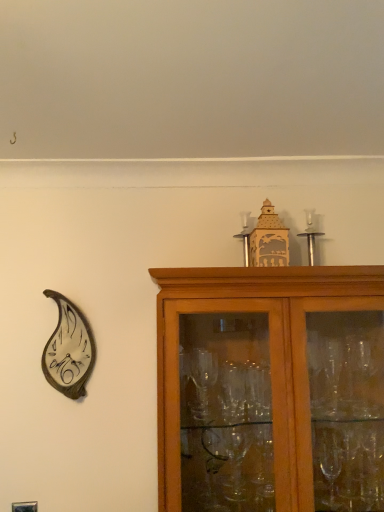
What do you see at coordinates (311, 234) in the screenshot? The width and height of the screenshot is (384, 512). I see `silver metallic candle holder at upper center, the first candle holder in the right-to-left sequence` at bounding box center [311, 234].

Where is `metallic leaf-shaped clock at left`? The width and height of the screenshot is (384, 512). metallic leaf-shaped clock at left is located at coordinates (69, 350).

Find the location of a particular element. This screenshot has width=384, height=512. silver metallic candle holder at upper center, which is the second candle holder from left to right is located at coordinates (311, 234).

Can we say brown wooden cabinet at upper right lies outside silver metallic candle holder at upper center, the 2th candle holder when ordered from right to left?

That's correct, brown wooden cabinet at upper right is outside of silver metallic candle holder at upper center, the 2th candle holder when ordered from right to left.

Between brown wooden cabinet at upper right and silver metallic candle holder at upper center, acting as the 1th candle holder starting from the left, which one has smaller size?

Smaller between the two is silver metallic candle holder at upper center, acting as the 1th candle holder starting from the left.

Considering the relative positions of brown wooden cabinet at upper right and silver metallic candle holder at upper center, the 2th candle holder when ordered from right to left, in the image provided, is brown wooden cabinet at upper right to the left or to the right of silver metallic candle holder at upper center, the 2th candle holder when ordered from right to left,?

brown wooden cabinet at upper right is to the right of silver metallic candle holder at upper center, the 2th candle holder when ordered from right to left.

Between brown wooden cabinet at upper right and silver metallic candle holder at upper center, the 2th candle holder when ordered from right to left, which one is positioned in front?

brown wooden cabinet at upper right is in front.

Consider the image. Can you tell me how much metallic leaf-shaped clock at left and silver metallic candle holder at upper center, acting as the 1th candle holder starting from the left, differ in facing direction?

The facing directions of metallic leaf-shaped clock at left and silver metallic candle holder at upper center, acting as the 1th candle holder starting from the left, are 0.264 degrees apart.

Considering the relative sizes of metallic leaf-shaped clock at left and silver metallic candle holder at upper center, the 2th candle holder when ordered from right to left, in the image provided, is metallic leaf-shaped clock at left bigger than silver metallic candle holder at upper center, the 2th candle holder when ordered from right to left,?

Indeed, metallic leaf-shaped clock at left has a larger size compared to silver metallic candle holder at upper center, the 2th candle holder when ordered from right to left.

Looking at their sizes, would you say metallic leaf-shaped clock at left is wider or thinner than silver metallic candle holder at upper center, the 2th candle holder when ordered from right to left?

Considering their sizes, metallic leaf-shaped clock at left looks broader than silver metallic candle holder at upper center, the 2th candle holder when ordered from right to left.

Considering the sizes of objects metallic leaf-shaped clock at left and silver metallic candle holder at upper center, the 2th candle holder when ordered from right to left, in the image provided, who is shorter, metallic leaf-shaped clock at left or silver metallic candle holder at upper center, the 2th candle holder when ordered from right to left,?

silver metallic candle holder at upper center, the 2th candle holder when ordered from right to left, is shorter.

Does point (313, 237) come farther from viewer compared to point (315, 449)?

Yes, point (313, 237) is farther from viewer.

How much distance is there between silver metallic candle holder at upper center, the first candle holder in the right-to-left sequence, and brown wooden cabinet at upper right?

silver metallic candle holder at upper center, the first candle holder in the right-to-left sequence, is 21.98 inches from brown wooden cabinet at upper right.

Is silver metallic candle holder at upper center, which is the second candle holder from left to right, far away from brown wooden cabinet at upper right?

No, silver metallic candle holder at upper center, which is the second candle holder from left to right, is in close proximity to brown wooden cabinet at upper right.

Do you think silver metallic candle holder at upper center, the first candle holder in the right-to-left sequence, is within brown wooden cabinet at upper right, or outside of it?

silver metallic candle holder at upper center, the first candle holder in the right-to-left sequence, is not inside brown wooden cabinet at upper right, it's outside.

Are brown wooden cabinet at upper right and silver metallic candle holder at upper center, which is the second candle holder from left to right, making contact?

No, brown wooden cabinet at upper right is not with silver metallic candle holder at upper center, which is the second candle holder from left to right.

In the scene shown: Between brown wooden cabinet at upper right and silver metallic candle holder at upper center, the first candle holder in the right-to-left sequence, which one has larger width?

brown wooden cabinet at upper right.

From the image's perspective, who appears lower, brown wooden cabinet at upper right or silver metallic candle holder at upper center, the first candle holder in the right-to-left sequence?

brown wooden cabinet at upper right is shown below in the image.

How different are the orientations of silver metallic candle holder at upper center, the 2th candle holder when ordered from right to left, and silver metallic candle holder at upper center, the first candle holder in the right-to-left sequence, in degrees?

The angular difference between silver metallic candle holder at upper center, the 2th candle holder when ordered from right to left, and silver metallic candle holder at upper center, the first candle holder in the right-to-left sequence, is 1.16 degrees.

Is the position of silver metallic candle holder at upper center, the 2th candle holder when ordered from right to left, more distant than that of silver metallic candle holder at upper center, the first candle holder in the right-to-left sequence?

That is False.

Is silver metallic candle holder at upper center, acting as the 1th candle holder starting from the left, thinner than silver metallic candle holder at upper center, which is the second candle holder from left to right?

Correct, the width of silver metallic candle holder at upper center, acting as the 1th candle holder starting from the left, is less than that of silver metallic candle holder at upper center, which is the second candle holder from left to right.

Looking at this image, from a real-world perspective, is brown wooden cabinet at upper right positioned above or below metallic leaf-shaped clock at left?

From a real-world perspective, brown wooden cabinet at upper right is physically below metallic leaf-shaped clock at left.

Would you say brown wooden cabinet at upper right is to the left or to the right of metallic leaf-shaped clock at left in the picture?

Based on their positions, brown wooden cabinet at upper right is located to the right of metallic leaf-shaped clock at left.

Can you see brown wooden cabinet at upper right touching metallic leaf-shaped clock at left?

No, brown wooden cabinet at upper right is not next to metallic leaf-shaped clock at left.

Does point (314, 259) come farther from viewer compared to point (243, 250)?

That is True.

From a real-world perspective, is silver metallic candle holder at upper center, which is the second candle holder from left to right, located higher than silver metallic candle holder at upper center, acting as the 1th candle holder starting from the left?

Yes, from a real-world perspective, silver metallic candle holder at upper center, which is the second candle holder from left to right, is over silver metallic candle holder at upper center, acting as the 1th candle holder starting from the left

You are a GUI agent. You are given a task and a screenshot of the screen. Output one action in this format:
    pyautogui.click(x=<x>, y=<y>)
    Task: Click on the candle holder below the silver metallic candle holder at upper center, the first candle holder in the right-to-left sequence (from a real-world perspective)
    Image resolution: width=384 pixels, height=512 pixels.
    Given the screenshot: What is the action you would take?
    pyautogui.click(x=244, y=236)

Is silver metallic candle holder at upper center, the first candle holder in the right-to-left sequence, positioned far away from silver metallic candle holder at upper center, acting as the 1th candle holder starting from the left?

Actually, silver metallic candle holder at upper center, the first candle holder in the right-to-left sequence, and silver metallic candle holder at upper center, acting as the 1th candle holder starting from the left, are a little close together.

Locate an element on the screen. candle holder that is the 1st one when counting upward from the brown wooden cabinet at upper right (from the image's perspective) is located at coordinates (244, 236).

The width and height of the screenshot is (384, 512). I want to click on clock beneath the silver metallic candle holder at upper center, the 2th candle holder when ordered from right to left (from a real-world perspective), so click(69, 350).

From the image, which object appears to be farther from brown wooden cabinet at upper right, silver metallic candle holder at upper center, the first candle holder in the right-to-left sequence, or metallic leaf-shaped clock at left?

metallic leaf-shaped clock at left is positioned further to the anchor brown wooden cabinet at upper right.

Looking at the image, which one is located closer to silver metallic candle holder at upper center, acting as the 1th candle holder starting from the left, silver metallic candle holder at upper center, which is the second candle holder from left to right, or metallic leaf-shaped clock at left?

Based on the image, silver metallic candle holder at upper center, which is the second candle holder from left to right, appears to be nearer to silver metallic candle holder at upper center, acting as the 1th candle holder starting from the left.

Looking at this image, looking at the image, which one is located closer to silver metallic candle holder at upper center, acting as the 1th candle holder starting from the left, brown wooden cabinet at upper right or metallic leaf-shaped clock at left?

brown wooden cabinet at upper right lies closer to silver metallic candle holder at upper center, acting as the 1th candle holder starting from the left, than the other object.

Based on their spatial positions, is silver metallic candle holder at upper center, the first candle holder in the right-to-left sequence, or silver metallic candle holder at upper center, acting as the 1th candle holder starting from the left, further from metallic leaf-shaped clock at left?

silver metallic candle holder at upper center, the first candle holder in the right-to-left sequence, is positioned further to the anchor metallic leaf-shaped clock at left.

Looking at the image, which one is located further to metallic leaf-shaped clock at left, brown wooden cabinet at upper right or silver metallic candle holder at upper center, which is the second candle holder from left to right?

silver metallic candle holder at upper center, which is the second candle holder from left to right, is positioned further to the anchor metallic leaf-shaped clock at left.

Which object lies nearer to the anchor point brown wooden cabinet at upper right, metallic leaf-shaped clock at left or silver metallic candle holder at upper center, the first candle holder in the right-to-left sequence?

Among the two, silver metallic candle holder at upper center, the first candle holder in the right-to-left sequence, is located nearer to brown wooden cabinet at upper right.

When comparing their distances from silver metallic candle holder at upper center, acting as the 1th candle holder starting from the left, does metallic leaf-shaped clock at left or silver metallic candle holder at upper center, which is the second candle holder from left to right, seem closer?

Among the two, silver metallic candle holder at upper center, which is the second candle holder from left to right, is located nearer to silver metallic candle holder at upper center, acting as the 1th candle holder starting from the left.

From the image, which object appears to be farther from brown wooden cabinet at upper right, silver metallic candle holder at upper center, acting as the 1th candle holder starting from the left, or metallic leaf-shaped clock at left?

metallic leaf-shaped clock at left is further to brown wooden cabinet at upper right.

The width and height of the screenshot is (384, 512). Identify the location of candle holder between silver metallic candle holder at upper center, the first candle holder in the right-to-left sequence, and brown wooden cabinet at upper right vertically. (244, 236).

Identify the location of candle holder between metallic leaf-shaped clock at left and brown wooden cabinet at upper right. (244, 236).

The image size is (384, 512). I want to click on cabinetry situated between metallic leaf-shaped clock at left and silver metallic candle holder at upper center, which is the second candle holder from left to right, from left to right, so click(x=271, y=389).

This screenshot has height=512, width=384. In order to click on candle holder located between metallic leaf-shaped clock at left and silver metallic candle holder at upper center, which is the second candle holder from left to right, in the left-right direction in this screenshot , I will do `click(244, 236)`.